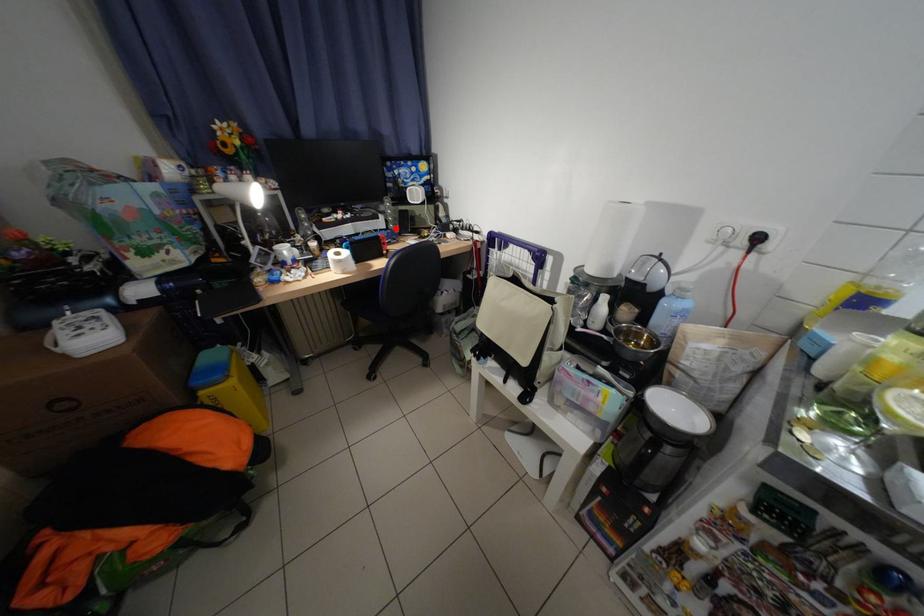
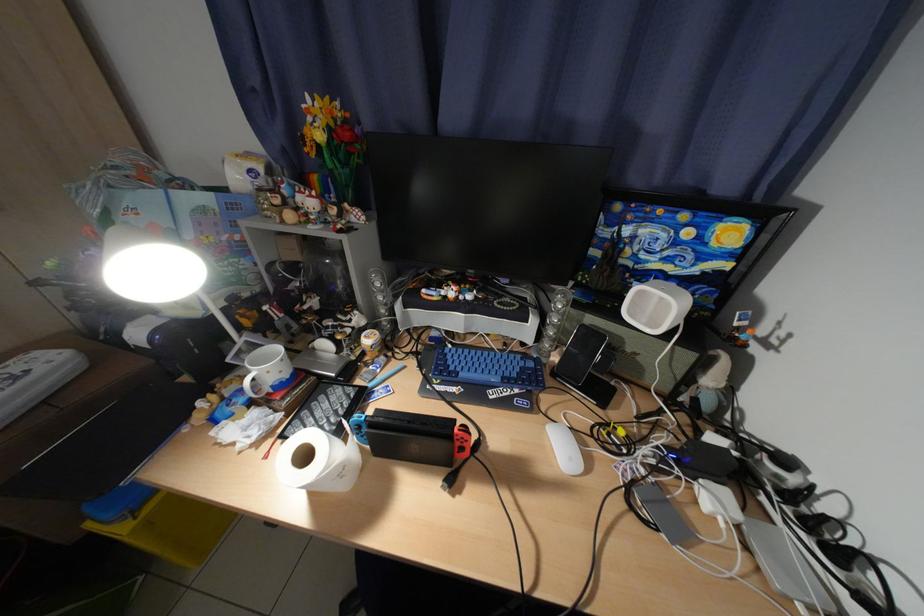
Locate, in the second image, the point that corresponds to the highlighted location in the first image.

(541, 342)